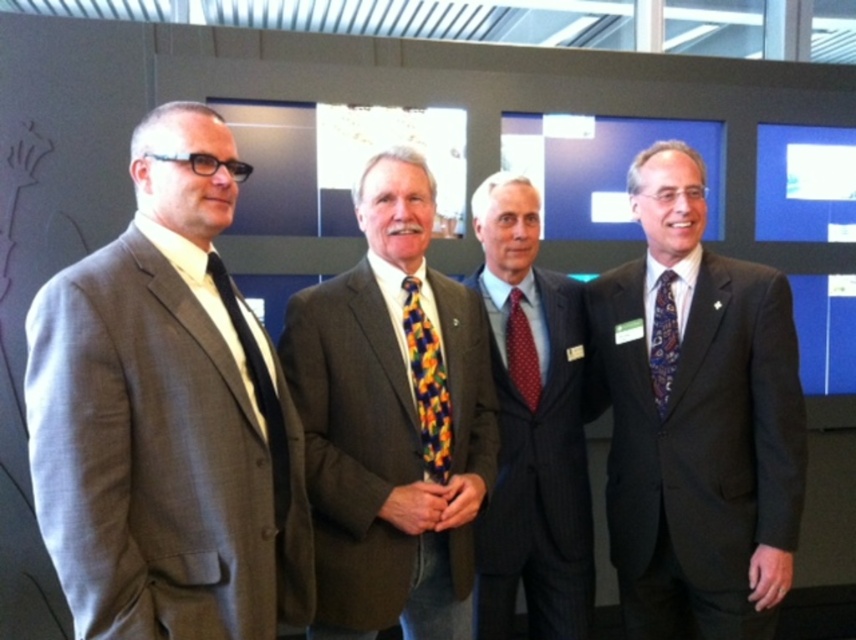
Is multicolored patterned tie at center in front of pinstriped wool suit at center?

That is True.

Between multicolored patterned tie at center and pinstriped wool suit at center, which one is positioned higher?

Positioned higher is multicolored patterned tie at center.

At what (x,y) coordinates should I click in order to perform the action: click on multicolored patterned tie at center. Please return your answer as a coordinate pair (x, y). Looking at the image, I should click on (391, 420).

In order to click on multicolored patterned tie at center in this screenshot , I will do `click(391, 420)`.

Is point (706, 394) farther from viewer compared to point (440, 516)?

Yes, it is.

Does dark gray suit at right appear under multicolored patterned tie at center?

Correct, dark gray suit at right is located below multicolored patterned tie at center.

The image size is (856, 640). Describe the element at coordinates (698, 422) in the screenshot. I see `dark gray suit at right` at that location.

Where is `dark gray suit at right`? dark gray suit at right is located at coordinates (698, 422).

Can you confirm if floral silk tie at center is positioned to the right of blue patterned tie at right?

Incorrect, floral silk tie at center is not on the right side of blue patterned tie at right.

Measure the distance between floral silk tie at center and blue patterned tie at right.

A distance of 56.00 centimeters exists between floral silk tie at center and blue patterned tie at right.

At what (x,y) coordinates should I click in order to perform the action: click on floral silk tie at center. Please return your answer as a coordinate pair (x, y). The width and height of the screenshot is (856, 640). Looking at the image, I should click on (428, 385).

The image size is (856, 640). I want to click on floral silk tie at center, so click(x=428, y=385).